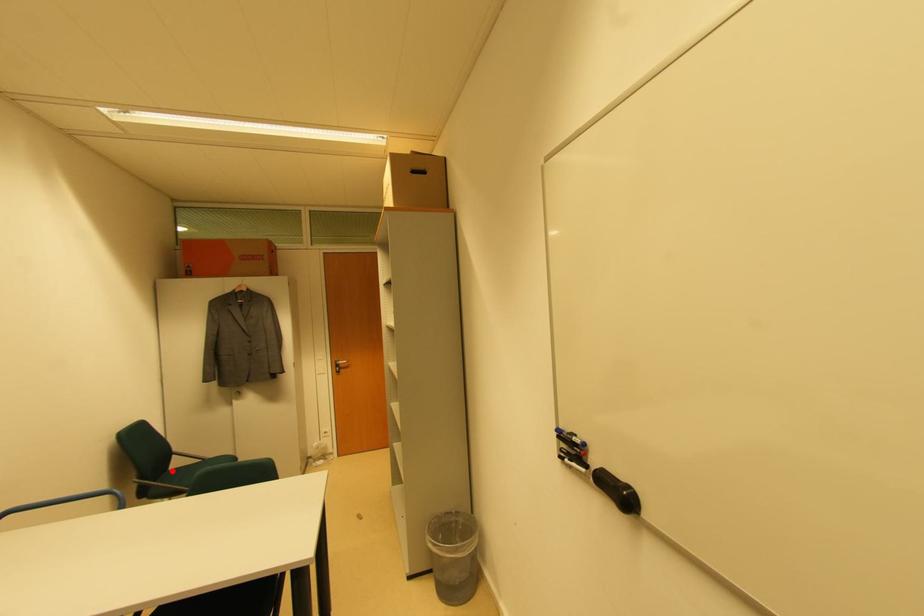
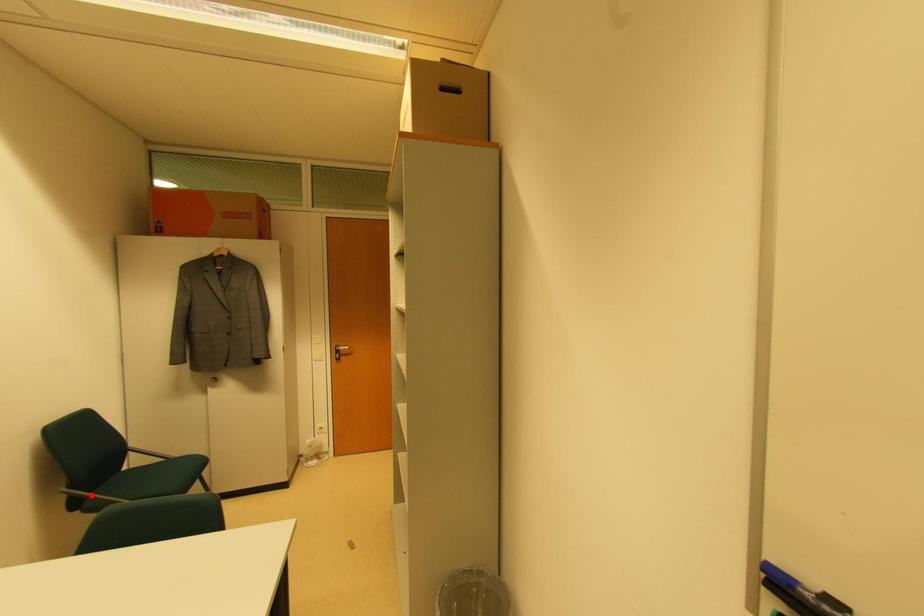
I am providing you with two images of the same scene from different viewpoints. A red point is marked on the first image and another point is marked on the second image. Does the point marked in image1 correspond to the same location as the one in image2?

No